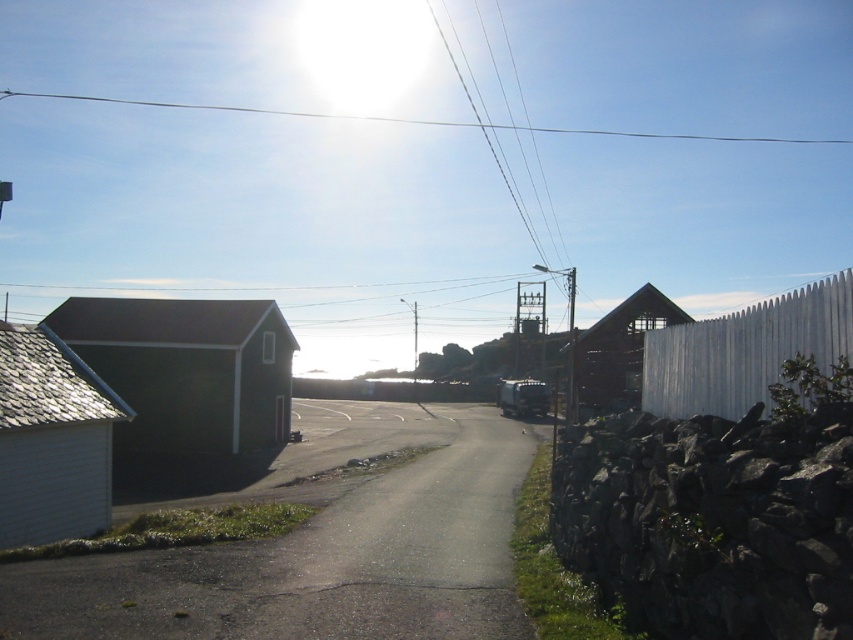
Question: Is dark green wood hut at left below white shiplap siding at left?

Choices:
 (A) no
 (B) yes

Answer: (A)

Question: Which point is closer to the camera?

Choices:
 (A) white wooden fence at right
 (B) white shiplap siding at left
 (C) clear wire at upper center
 (D) wooden hut at center-right

Answer: (A)

Question: Which point appears farthest from the camera in this image?

Choices:
 (A) (595, 413)
 (B) (64, 353)
 (C) (735, 419)
 (D) (199, 326)

Answer: (D)

Question: Observing the image, what is the correct spatial positioning of white shiplap siding at left in reference to wooden hut at center-right?

Choices:
 (A) above
 (B) below

Answer: (B)

Question: Can you confirm if white shiplap siding at left is positioned to the left of white wooden fence at right?

Choices:
 (A) no
 (B) yes

Answer: (B)

Question: Which point is farther to the camera?

Choices:
 (A) wooden hut at center-right
 (B) clear wire at upper center

Answer: (B)